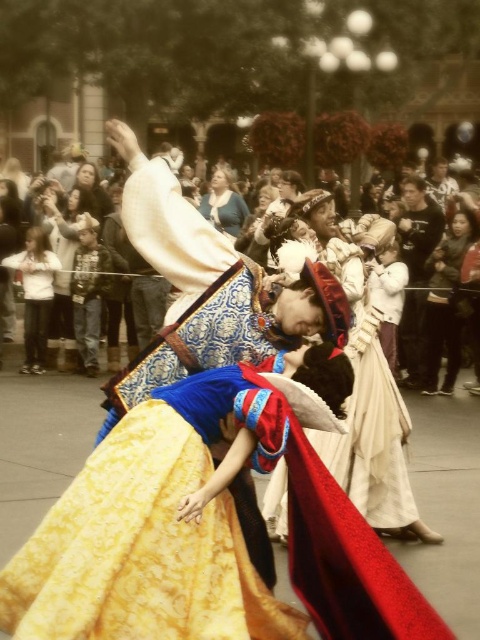
Question: Can you confirm if dark brown leather jacket at right is positioned below white cotton hoodie at left?

Choices:
 (A) yes
 (B) no

Answer: (A)

Question: Is matte blue dress at center to the left of smooth beige dress at upper left from the viewer's perspective?

Choices:
 (A) no
 (B) yes

Answer: (A)

Question: Considering the real-world distances, which object is closest to the white cotton hoodie at left?

Choices:
 (A) matte black jacket at left
 (B) dark brown leather jacket at right

Answer: (A)

Question: Which object appears farthest from the camera in this image?

Choices:
 (A) black cotton shirt at right
 (B) matte black jacket at left
 (C) white cotton hoodie at left
 (D) smooth beige dress at upper left

Answer: (D)

Question: Does dark brown leather jacket at right appear on the right side of matte black jacket at left?

Choices:
 (A) no
 (B) yes

Answer: (B)

Question: Which of the following is the farthest from the observer?

Choices:
 (A) dark brown leather jacket at right
 (B) matte blue dress at center

Answer: (B)